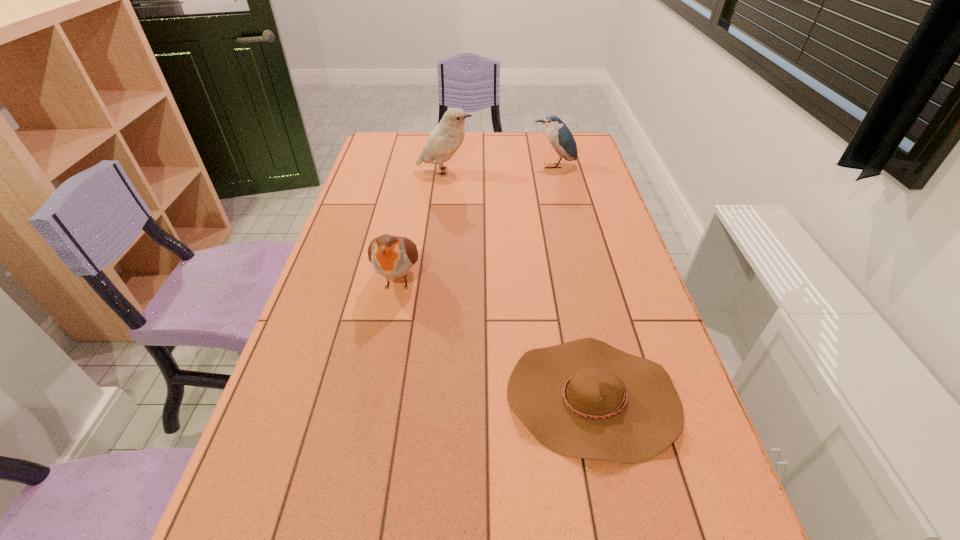
In order to click on vacant space in between the rightmost bird and the nearest bird in this screenshot , I will do `click(476, 222)`.

Locate an element on the screen. free area in between the rightmost bird and the cowboy hat is located at coordinates (573, 282).

In order to click on vacant space in between the cowboy hat and the third farthest object in this screenshot , I will do `click(495, 338)`.

At what (x,y) coordinates should I click in order to perform the action: click on blank region between the tallest bird and the nearest bird. Please return your answer as a coordinate pair (x, y). This screenshot has width=960, height=540. Looking at the image, I should click on (421, 225).

The image size is (960, 540). In order to click on unoccupied area between the cowboy hat and the tallest bird in this screenshot , I will do `click(518, 285)`.

The width and height of the screenshot is (960, 540). I want to click on vacant space that's between the rightmost bird and the shortest object, so click(573, 282).

This screenshot has width=960, height=540. I want to click on unoccupied area between the tallest bird and the cowboy hat, so click(x=518, y=285).

Select which object appears as the closest to the nearest bird. Please provide its 2D coordinates. Your answer should be formatted as a tuple, i.e. [(x, y)], where the tuple contains the x and y coordinates of a point satisfying the conditions above.

[(585, 399)]

Point out which object is positioned as the nearest to the nearest bird. Please provide its 2D coordinates. Your answer should be formatted as a tuple, i.e. [(x, y)], where the tuple contains the x and y coordinates of a point satisfying the conditions above.

[(585, 399)]

Identify which bird is located as the nearest to the shortest object. Please provide its 2D coordinates. Your answer should be formatted as a tuple, i.e. [(x, y)], where the tuple contains the x and y coordinates of a point satisfying the conditions above.

[(391, 256)]